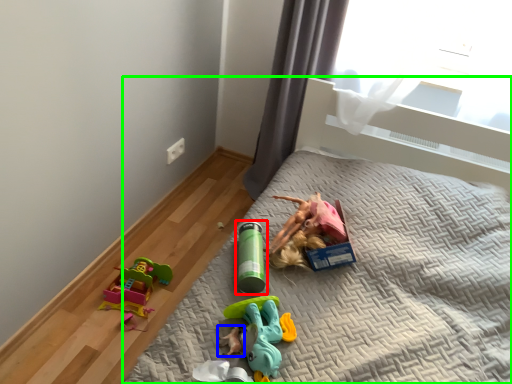
Question: Which object is the closest to the toy (highlighted by a red box)? Choose among these: toy (highlighted by a blue box) or bed (highlighted by a green box).

Choices:
 (A) toy
 (B) bed

Answer: (A)